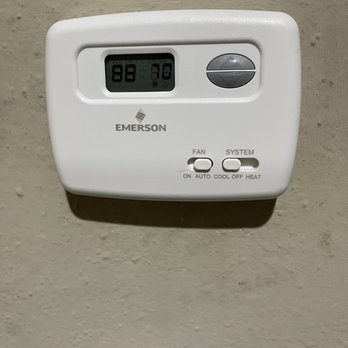
In order to click on digital clock style face in this screenshot , I will do `click(127, 73)`.